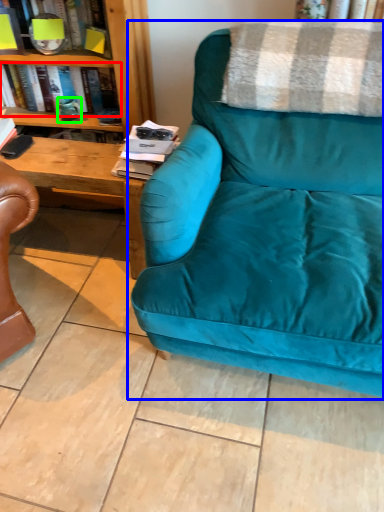
Question: Which is nearer to the book (highlighted by a red box)? studio couch (highlighted by a blue box) or teal (highlighted by a green box).

Choices:
 (A) studio couch
 (B) teal

Answer: (B)